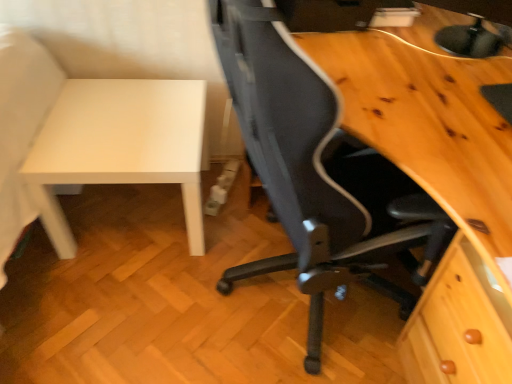
Where is `free spot above white matte table at left (from a real-world perspective)`? free spot above white matte table at left (from a real-world perspective) is located at coordinates (120, 119).